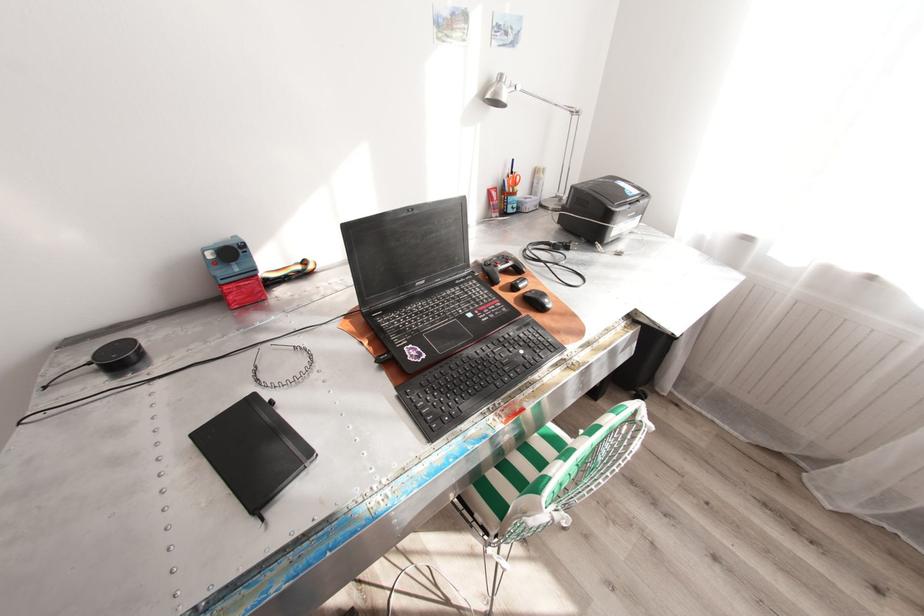
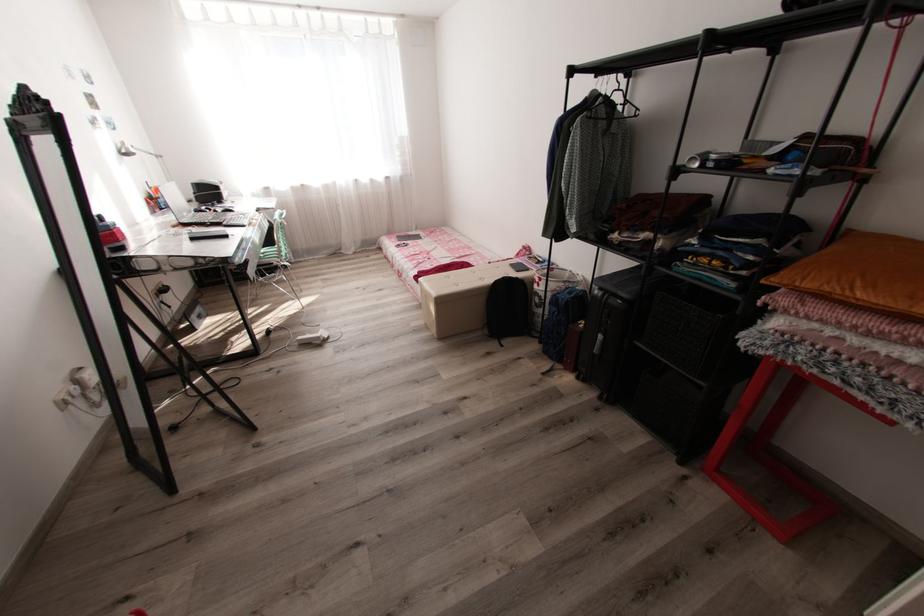
In the second image, find the point that corresponds to the point at 515,209 in the first image.

(167, 207)